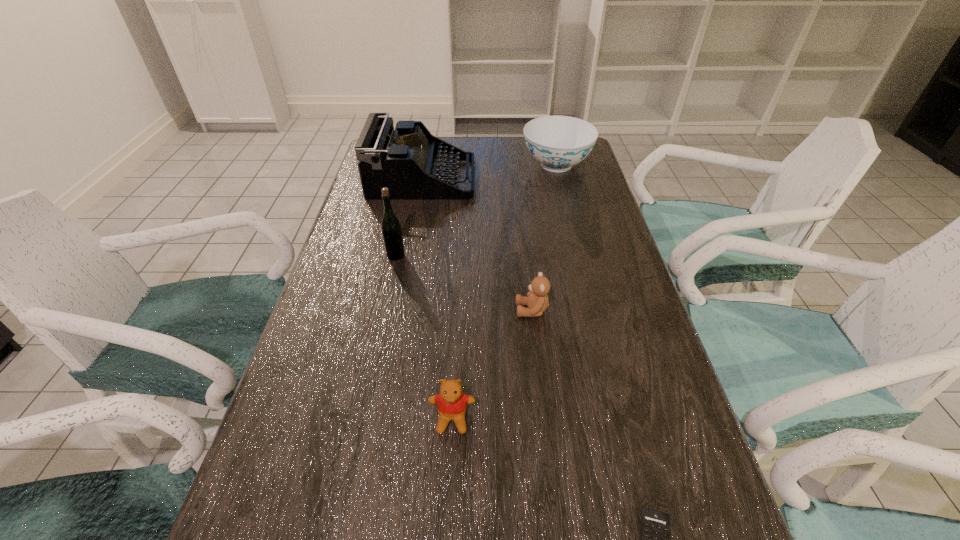
At what (x,y) coordinates should I click in order to perform the action: click on vacant space located 0.150m on the front-facing side of the left teddy bear. Please return your answer as a coordinate pair (x, y). The image size is (960, 540). Looking at the image, I should click on (446, 528).

At what (x,y) coordinates should I click in order to perform the action: click on vacant space situated 0.380m on the face of the right teddy bear. Please return your answer as a coordinate pair (x, y). The image size is (960, 540). Looking at the image, I should click on (350, 310).

You are a GUI agent. You are given a task and a screenshot of the screen. Output one action in this format:
    pyautogui.click(x=<x>, y=<y>)
    Task: Click on the blank space located 0.100m on the face of the right teddy bear
    Image resolution: width=960 pixels, height=540 pixels.
    Given the screenshot: What is the action you would take?
    pyautogui.click(x=472, y=310)

In order to click on free space located 0.130m on the face of the right teddy bear in this screenshot , I will do `click(459, 310)`.

Find the location of `typewriter located in the far edge section of the desktop`. typewriter located in the far edge section of the desktop is located at coordinates (413, 164).

Locate an element on the screen. The height and width of the screenshot is (540, 960). chinaware that is at the far edge is located at coordinates (557, 142).

At what (x,y) coordinates should I click in order to perform the action: click on beer bottle that is at the left edge. Please return your answer as a coordinate pair (x, y). Looking at the image, I should click on (391, 229).

Locate an element on the screen. The height and width of the screenshot is (540, 960). typewriter present at the left edge is located at coordinates (413, 164).

Where is `object that is at the right edge`? object that is at the right edge is located at coordinates (557, 142).

What are the coordinates of `object that is at the far left corner` in the screenshot? It's located at click(413, 164).